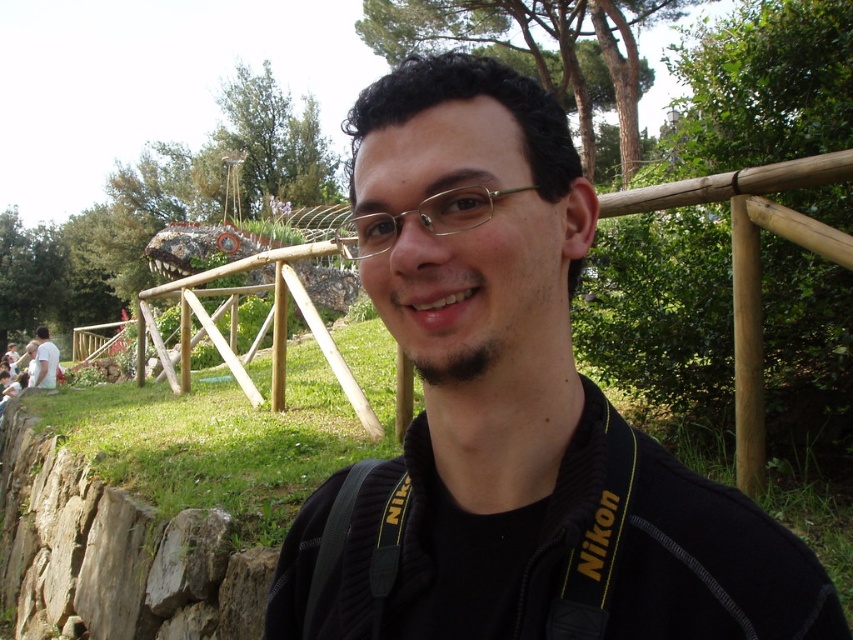
Question: Does black matte jacket at center appear on the left side of white cotton shirt at lower left?

Choices:
 (A) yes
 (B) no

Answer: (B)

Question: Which point appears closest to the camera in this image?

Choices:
 (A) (473, 102)
 (B) (36, 348)
 (C) (352, 252)

Answer: (A)

Question: Where is black matte jacket at center located in relation to gold metallic glasses at center in the image?

Choices:
 (A) above
 (B) below

Answer: (B)

Question: Which of the following is the closest to the observer?

Choices:
 (A) (48, 365)
 (B) (439, 198)

Answer: (B)

Question: Considering the relative positions of black matte jacket at center and gold metallic glasses at center in the image provided, where is black matte jacket at center located with respect to gold metallic glasses at center?

Choices:
 (A) below
 (B) above

Answer: (A)

Question: Which of the following is the farthest from the observer?

Choices:
 (A) black matte jacket at center
 (B) white cotton shirt at lower left
 (C) gold metallic glasses at center

Answer: (B)